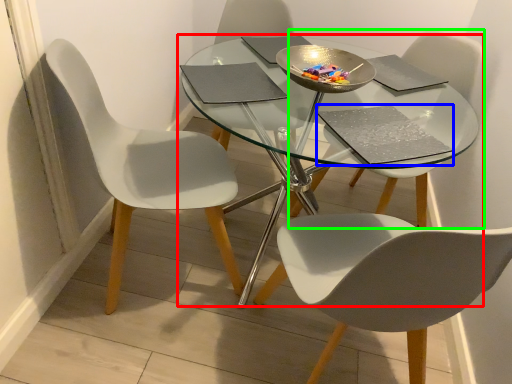
Question: Which object is the closest to the table (highlighted by a red box)? Choose among these: pad (highlighted by a blue box) or chair (highlighted by a green box).

Choices:
 (A) pad
 (B) chair

Answer: (A)